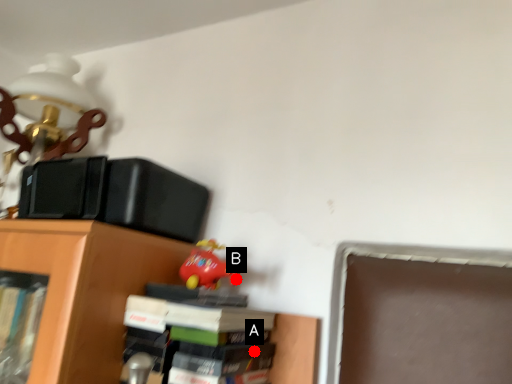
Question: Two points are circled on the image, labeled by A and B beside each circle. Among these points, which one is nearest to the camera?

Choices:
 (A) A is closer
 (B) B is closer

Answer: (A)